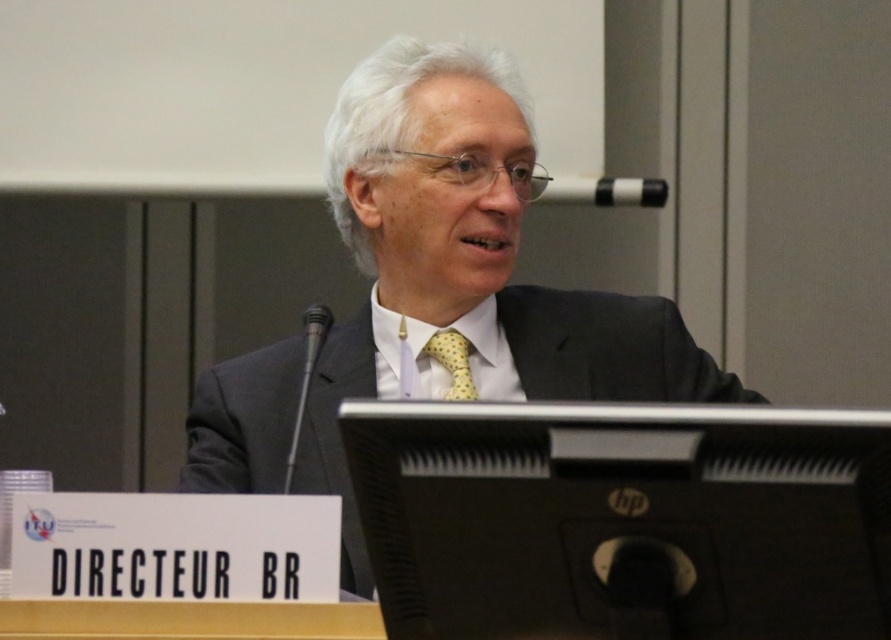
Question: Which object appears farthest from the camera in this image?

Choices:
 (A) yellow dotted fabric tie at center
 (B) metallic silver microphone at center
 (C) black plastic microphone at upper center

Answer: (C)

Question: Is metallic silver microphone at center positioned behind yellow dotted fabric tie at center?

Choices:
 (A) yes
 (B) no

Answer: (B)

Question: Among these objects, which one is nearest to the camera?

Choices:
 (A) matte black suit at center
 (B) yellow dotted fabric tie at center
 (C) metallic silver microphone at center
 (D) black plastic microphone at upper center

Answer: (C)

Question: Which point is closer to the camera?

Choices:
 (A) (364, 342)
 (B) (455, 385)
 (C) (297, 406)

Answer: (C)

Question: Is black plastic microphone at upper center positioned behind yellow dotted fabric tie at center?

Choices:
 (A) yes
 (B) no

Answer: (A)

Question: Considering the relative positions of metallic silver microphone at center and yellow dotted fabric tie at center in the image provided, where is metallic silver microphone at center located with respect to yellow dotted fabric tie at center?

Choices:
 (A) left
 (B) right

Answer: (A)